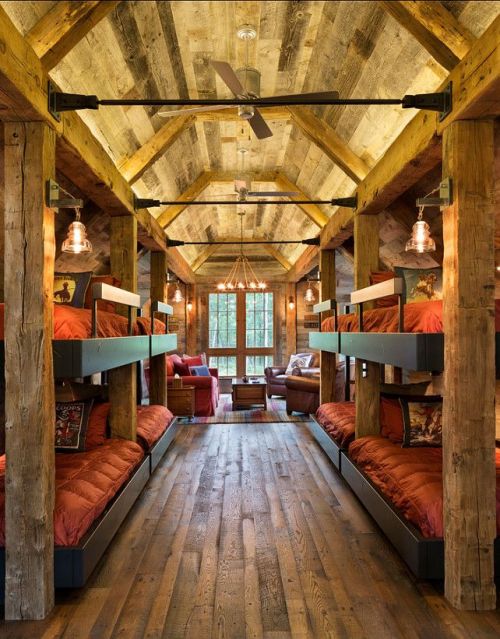
This screenshot has height=639, width=500. I want to click on light, so click(227, 288), click(251, 288), click(73, 239), click(419, 240).